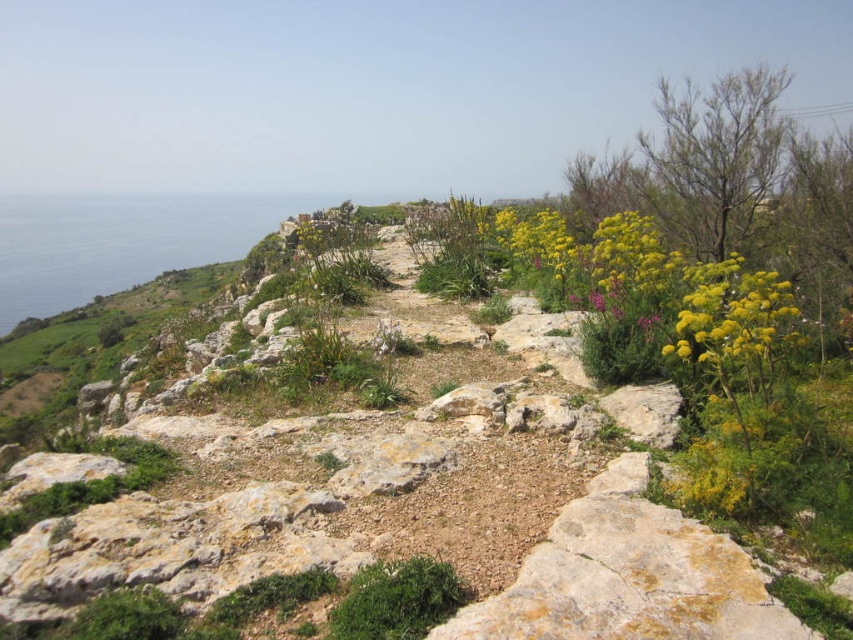
You are standing at the point with coordinates point [672,348] and want to walk towards the point with coordinates point [96,237]. Given the rugged, rocky landscape described, will you have to climb uphill or downhill?

Since point [96,237] is behind point [672,348], you will have to climb uphill to reach it.